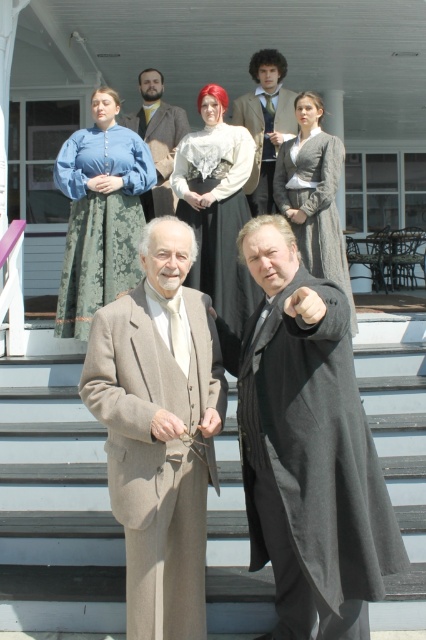
Is light brown wool suit at center to the left of brown wool coat at upper center from the viewer's perspective?

Indeed, light brown wool suit at center is positioned on the left side of brown wool coat at upper center.

Does light brown wool suit at center come behind brown wool coat at upper center?

No, it is in front of brown wool coat at upper center.

Locate an element on the screen. The height and width of the screenshot is (640, 426). light brown wool suit at center is located at coordinates (158, 429).

Does black satin dress at center have a greater width compared to gray wool dress at center?

Indeed, black satin dress at center has a greater width compared to gray wool dress at center.

Who is positioned more to the right, black satin dress at center or gray wool dress at center?

gray wool dress at center is more to the right.

Image resolution: width=426 pixels, height=640 pixels. I want to click on black satin dress at center, so click(x=218, y=214).

From the picture: Can you confirm if gray wool dress at center is shorter than brown wool suit at upper center?

In fact, gray wool dress at center may be taller than brown wool suit at upper center.

Is gray wool dress at center taller than brown wool suit at upper center?

Correct, gray wool dress at center is much taller as brown wool suit at upper center.

Describe the element at coordinates (314, 204) in the screenshot. This screenshot has height=640, width=426. I see `gray wool dress at center` at that location.

You are a GUI agent. You are given a task and a screenshot of the screen. Output one action in this format:
    pyautogui.click(x=<x>, y=<y>)
    Task: Click on the gray wool dress at center
    
    Given the screenshot: What is the action you would take?
    pyautogui.click(x=314, y=204)